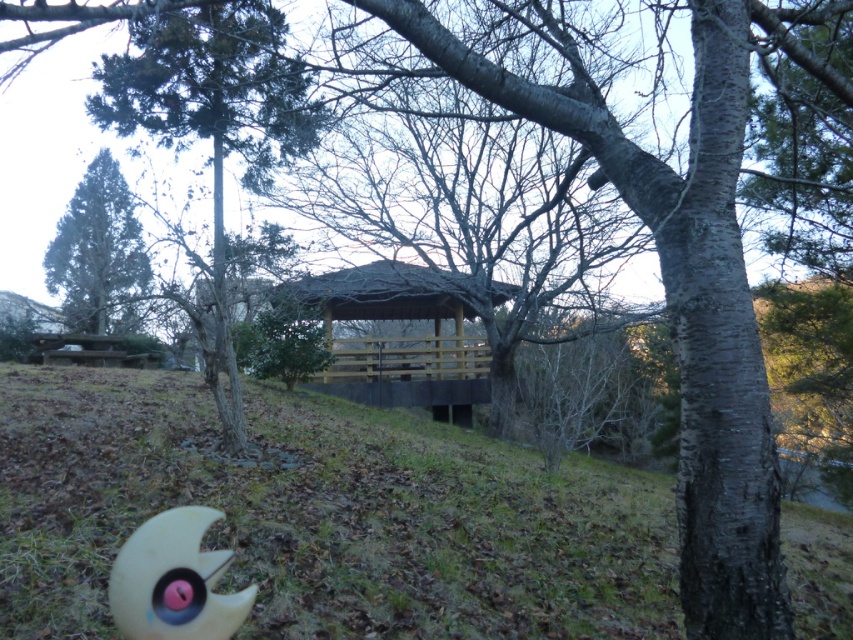
You are an outdoor photographer setting up a tripod. You want to capture both the brown dry grass at lower center and the green matte tree at upper left in your shot. Which object will appear closer to the camera in the final photo?

The brown dry grass at lower center will appear closer to the camera because it is positioned in front of the green matte tree at upper left.

In the scene shown: You are an artist setting up an easel to paint the scene. You want to capture the pink rubber crescent moon at lower left and the green matte tree at upper left. Which object should you focus on first if you want to paint the smaller one first?

The pink rubber crescent moon at lower left has a lesser width compared to the green matte tree at upper left, so you should focus on painting the pink rubber crescent moon at lower left first since it is smaller in width.